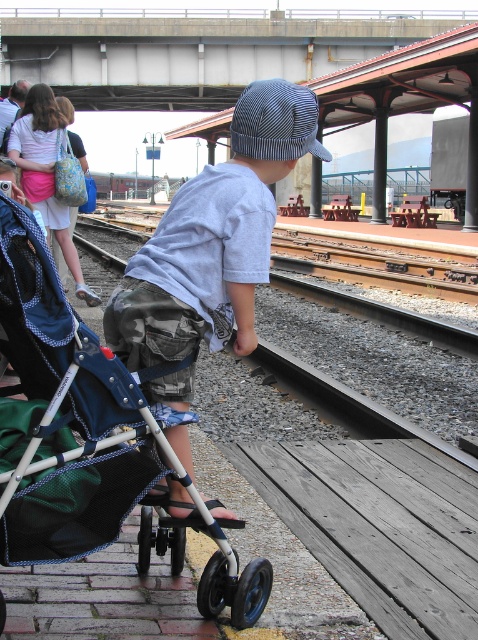
Based on the photo, you are a parent at the train station platform. You see your child wearing a light blue cotton shirt at center and a blue fabric stroller at lower left. Which item is smaller?

The blue fabric stroller at lower left is smaller than the light blue cotton shirt at center.

You are a parent at the train station platform. You see your child standing near the edge of the platform and your blue fabric stroller at lower left. The brown gravel train track at center is where the train will arrive. If you want to quickly retrieve your child and secure the stroller, can you reach them both within 3 meters?

The blue fabric stroller at lower left and brown gravel train track at center are 3.30 meters apart from each other. Since the distance between them is more than 3 meters, you cannot reach both the child and secure the stroller within 3 meters.